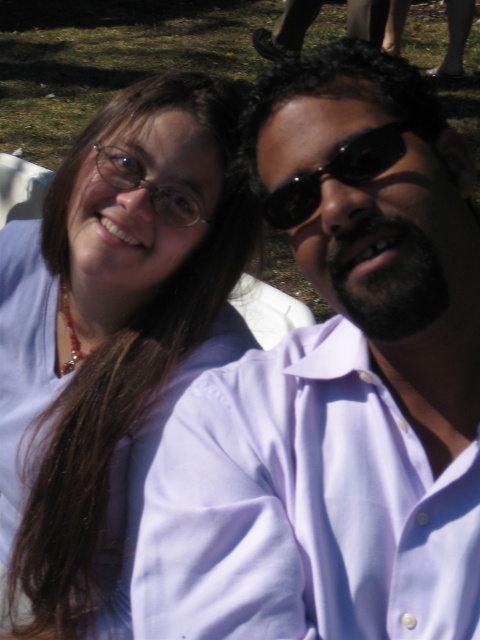
You are trying to identify two items in the image. The matte white shirt at upper right and the black matte sunglasses at upper right. Which one is positioned more to the left?

The matte white shirt at upper right is positioned to the left of black matte sunglasses at upper right, so the matte white shirt at upper right is more to the left.

You are taking a photo of two people sitting on the grass. You notice the matte white shirt at left and the black matte sunglasses at upper right. Which object is closer to the camera?

The matte white shirt at left is closer to the camera because the black matte sunglasses at upper right is behind it.

You are a photographer trying to capture a closeup of the matte white shirt at upper right and the black matte sunglasses at upper right in the image. Which object should you zoom in on more to ensure both are equally visible in the photo?

The matte white shirt at upper right is larger than the black matte sunglasses at upper right. To make them appear equally visible, you should zoom in slightly more on the black matte sunglasses at upper right since it is smaller.